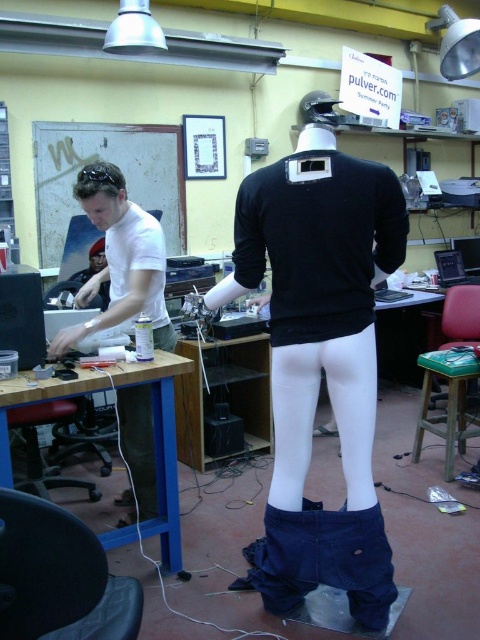
Question: Is green fabric stool at lower right bigger than black plastic stool at lower left?

Choices:
 (A) yes
 (B) no

Answer: (A)

Question: Where is white matte shirt at left located in relation to matte black jacket at upper left in the image?

Choices:
 (A) left
 (B) right

Answer: (B)

Question: Estimate the real-world distances between objects in this image. Which object is closer to the black plastic stool at lower left?

Choices:
 (A) black matte shirt at center
 (B) green fabric stool at lower right
 (C) matte black jacket at upper left
 (D) white matte shirt at left

Answer: (D)

Question: Can you confirm if white matte shirt at left is smaller than black plastic stool at lower left?

Choices:
 (A) yes
 (B) no

Answer: (A)

Question: Which of the following is the farthest from the observer?

Choices:
 (A) black plastic stool at lower left
 (B) black matte shirt at center
 (C) green fabric stool at lower right
 (D) white matte shirt at left

Answer: (C)

Question: Among these objects, which one is nearest to the camera?

Choices:
 (A) black matte shirt at center
 (B) white matte shirt at left
 (C) black plastic stool at lower left

Answer: (A)